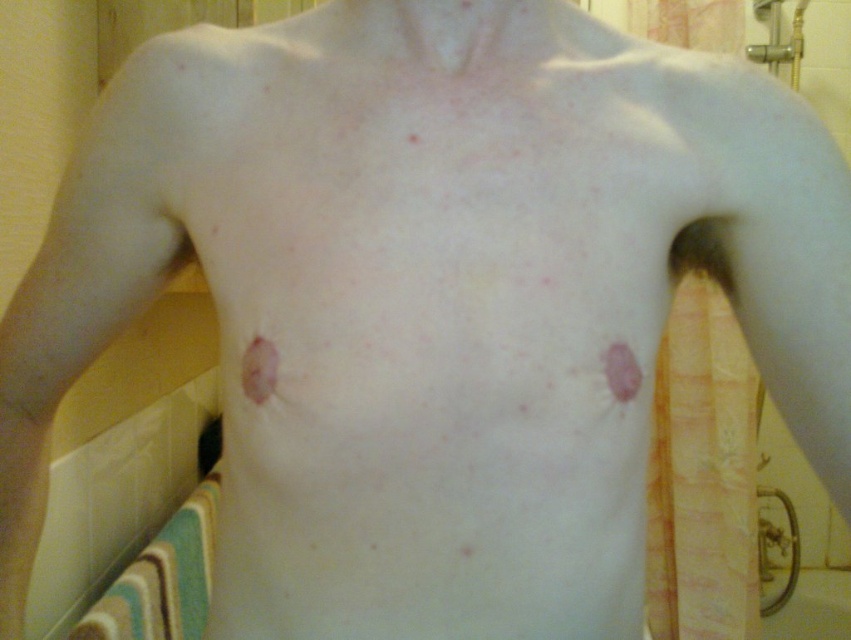
You are a healthcare professional examining a patient in a bathroom setting. You notice the metallic silver shower at upper right and the pink matte mole at center. Which object is closer to your line of sight?

The metallic silver shower at upper right is closer to your line of sight because it is further to the viewer than the pink matte mole at center.

Based on the photo, you are a dermatologist examining a patient in a bathroom setting. You notice the metallic silver shower at upper right and the pink matte mole at center. Based on their positions, which object is located to the right of the other?

The metallic silver shower at upper right is located to the right of the pink matte mole at center.